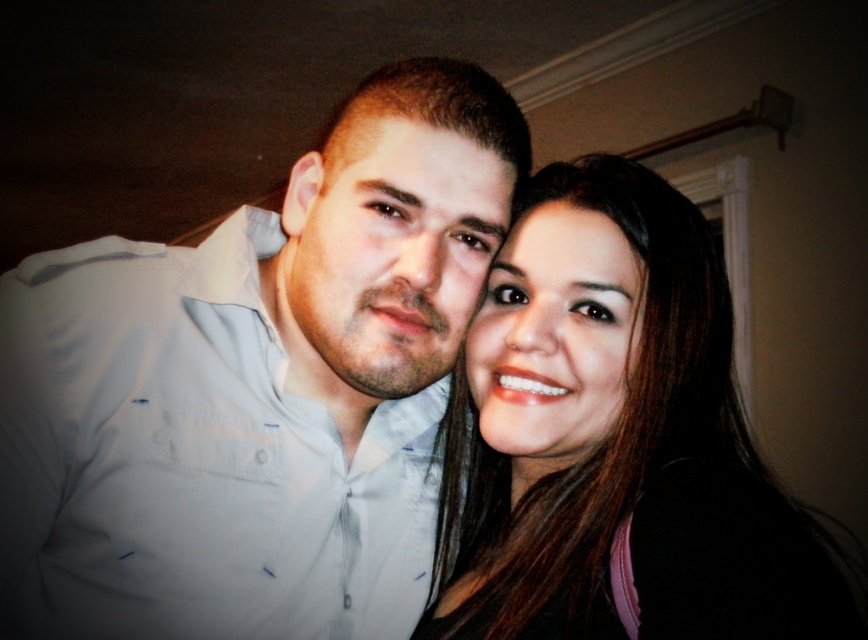
Question: Among these points, which one is nearest to the camera?

Choices:
 (A) (187, 352)
 (B) (584, 557)

Answer: (B)

Question: Does white shirt at center have a greater width compared to smooth brown hair at center?

Choices:
 (A) no
 (B) yes

Answer: (B)

Question: Is white shirt at center closer to the viewer compared to smooth brown hair at center?

Choices:
 (A) no
 (B) yes

Answer: (A)

Question: Does white shirt at center come behind smooth brown hair at center?

Choices:
 (A) no
 (B) yes

Answer: (B)

Question: Which of the following is the farthest from the observer?

Choices:
 (A) (682, 323)
 (B) (377, 355)

Answer: (A)